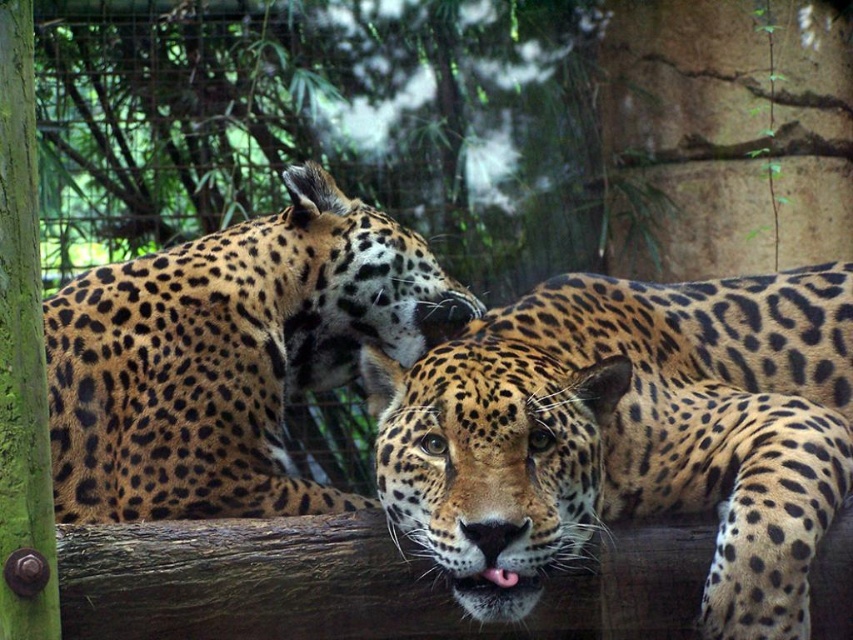
Question: Does spotted fur leopard at center appear under spotted fur leopard at upper left?

Choices:
 (A) yes
 (B) no

Answer: (B)

Question: Can you confirm if spotted fur leopard at center is wider than spotted fur leopard at upper left?

Choices:
 (A) no
 (B) yes

Answer: (B)

Question: Which point is farther to the camera?

Choices:
 (A) spotted fur leopard at upper left
 (B) spotted fur leopard at center

Answer: (A)

Question: Can you confirm if spotted fur leopard at center is smaller than spotted fur leopard at upper left?

Choices:
 (A) yes
 (B) no

Answer: (B)

Question: Which point is closer to the camera?

Choices:
 (A) (310, 364)
 (B) (676, 337)

Answer: (B)